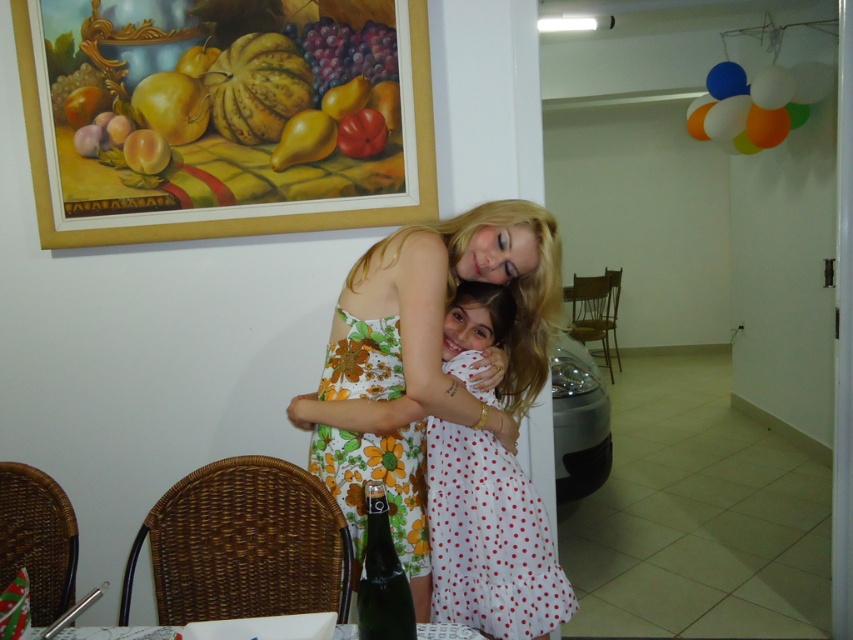
Which is in front, point (285, 129) or point (373, 131)?

Point (373, 131)

Who is lower down, yellow matte pear at center or shiny red tomato at upper center?

yellow matte pear at center

Is point (331, 144) positioned behind point (378, 145)?

Yes, point (331, 144) is behind point (378, 145).

Find the location of a particular element. yellow matte pear at center is located at coordinates (305, 140).

Measure the distance from matte yellow melon at upper left to green glass bottle at lower center.

1.42 meters

Does point (189, 116) come farther from viewer compared to point (361, 602)?

Yes, point (189, 116) is farther from viewer.

This screenshot has height=640, width=853. What are the coordinates of `matte yellow melon at upper left` in the screenshot? It's located at coord(254,84).

Measure the distance between point (252,36) and camera.

The distance of point (252,36) from camera is 6.85 feet.

Is matte yellow melon at upper left bigger than shiny red tomato at upper center?

Yes.

Which is behind, point (236, 92) or point (379, 125)?

The point (236, 92) is behind.

The height and width of the screenshot is (640, 853). Find the location of `matte yellow melon at upper left`. matte yellow melon at upper left is located at coordinates (254, 84).